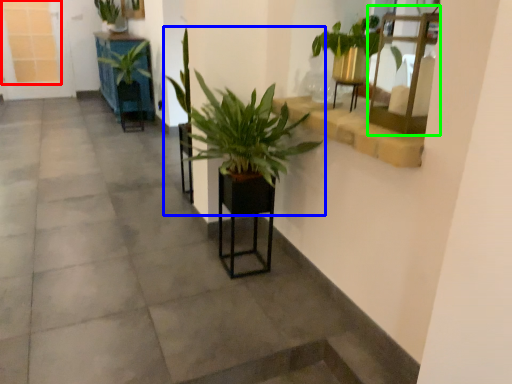
Question: Based on their relative distances, which object is farther from window frame (highlighted by a red box)? Choose from houseplant (highlighted by a blue box) and shelf (highlighted by a green box).

Choices:
 (A) houseplant
 (B) shelf

Answer: (B)